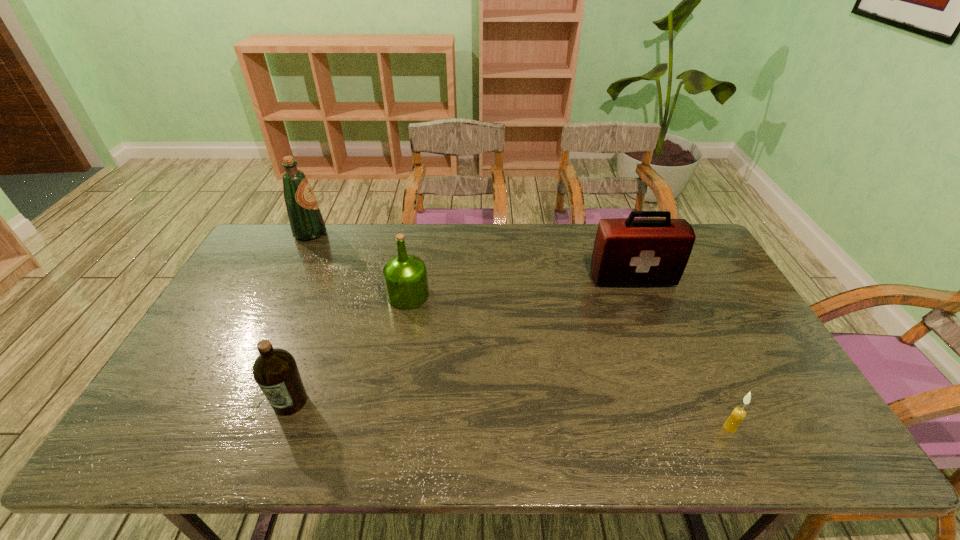
You are a GUI agent. You are given a task and a screenshot of the screen. Output one action in this format:
    pyautogui.click(x=<x>, y=<y>)
    Task: Click on the leftmost olive oil
    Image resolution: width=960 pixels, height=540 pixels.
    Given the screenshot: What is the action you would take?
    pyautogui.click(x=306, y=221)

Locate an element on the screen. The height and width of the screenshot is (540, 960). the farthest object is located at coordinates (306, 221).

The height and width of the screenshot is (540, 960). Find the location of `the first aid kit`. the first aid kit is located at coordinates (631, 251).

Locate an element on the screen. This screenshot has width=960, height=540. the third object from right to left is located at coordinates (405, 276).

I want to click on the second farthest olive oil, so click(405, 276).

Where is `the second object from left to right`? Image resolution: width=960 pixels, height=540 pixels. the second object from left to right is located at coordinates (275, 371).

This screenshot has height=540, width=960. What are the coordinates of `the second olive oil from left to right` in the screenshot? It's located at (275, 371).

Identify the location of the shortest object. (738, 414).

Find the location of a particular element. The width and height of the screenshot is (960, 540). the nearest object is located at coordinates (738, 414).

Where is `vacant space situated on the front-facing side of the leftmost olive oil`? vacant space situated on the front-facing side of the leftmost olive oil is located at coordinates (420, 233).